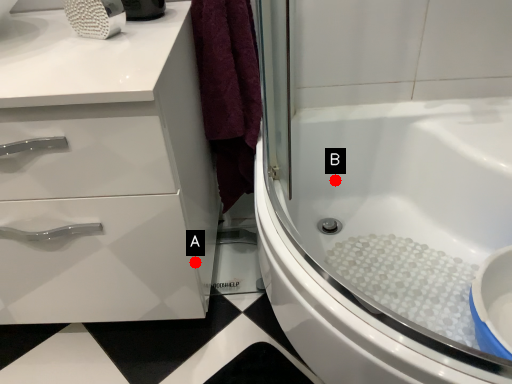
Question: Two points are circled on the image, labeled by A and B beside each circle. Which point is farther from the camera taking this photo?

Choices:
 (A) A is further
 (B) B is further

Answer: (B)